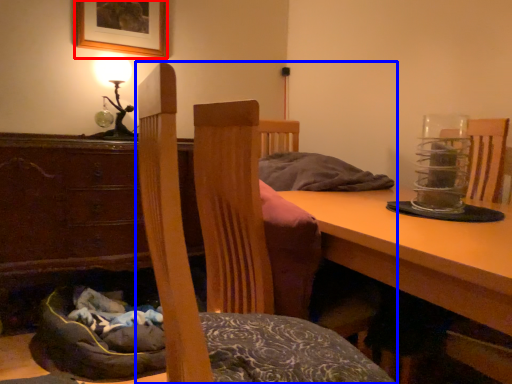
Question: Which object is closer to the camera taking this photo, picture frame (highlighted by a red box) or chair (highlighted by a blue box)?

Choices:
 (A) picture frame
 (B) chair

Answer: (B)